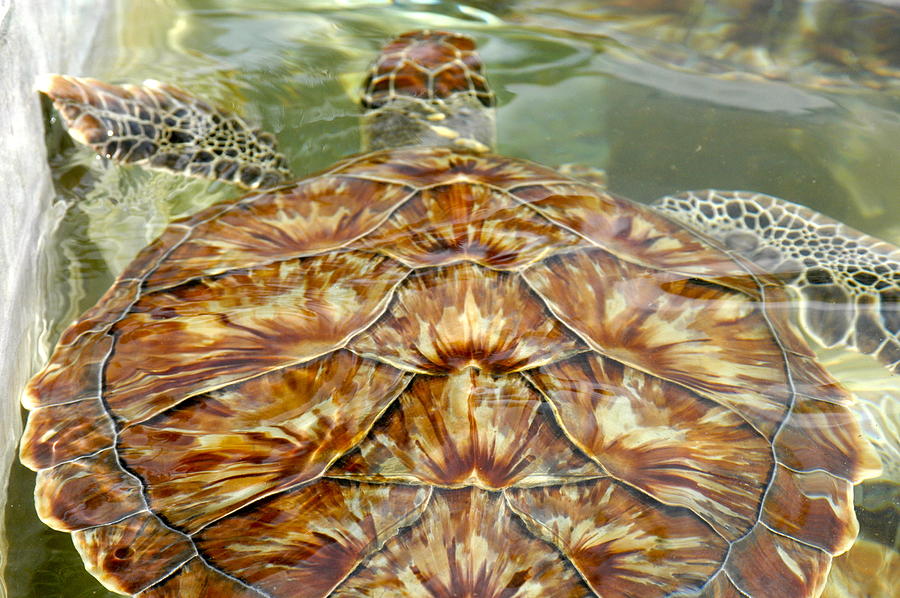
Identify the location of artwork. (595, 331).